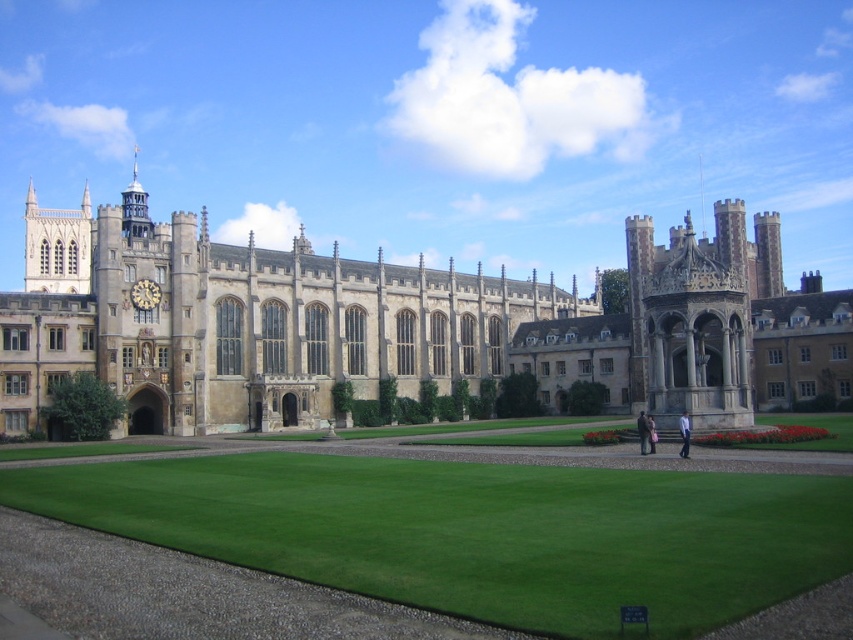
Consider the image. Is stone building at center positioned before gold metallic clock at upper left?

A: Yes, it is.

Does stone building at center have a larger size compared to gold metallic clock at upper left?

Correct, stone building at center is larger in size than gold metallic clock at upper left.

Which is behind, point (13, 344) or point (132, 292)?

Point (132, 292)

Where is `stone building at center`? This screenshot has height=640, width=853. stone building at center is located at coordinates (358, 321).

What do you see at coordinates (479, 531) in the screenshot?
I see `green lawn at center` at bounding box center [479, 531].

Who is more forward, (502, 604) or (146, 291)?

Point (502, 604) is in front.

Which is in front, point (483, 573) or point (148, 296)?

Positioned in front is point (483, 573).

Find the location of `green lawn at center`. green lawn at center is located at coordinates (479, 531).

Can you confirm if stone building at center is positioned above green lawn at center?

Yes, stone building at center is above green lawn at center.

Which is behind, point (656, 390) or point (549, 477)?

The point (656, 390) is behind.

Is point (196, 396) closer to camera compared to point (750, 474)?

No, it is not.

Locate an element on the screen. stone building at center is located at coordinates (358, 321).